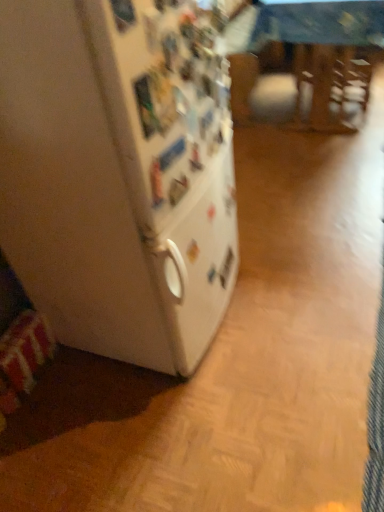
Find the location of `wooden table at center`. wooden table at center is located at coordinates (319, 23).

What do you see at coordinates (319, 23) in the screenshot?
I see `wooden table at center` at bounding box center [319, 23].

What is the approximate width of wooden table at center?

wooden table at center is 3.66 feet in width.

Describe the element at coordinates (119, 174) in the screenshot. I see `white matte refrigerator at left` at that location.

Where is `white matte refrigerator at left`? white matte refrigerator at left is located at coordinates (119, 174).

Identify the location of wooden table at center. Image resolution: width=384 pixels, height=512 pixels. (319, 23).

Does white matte refrigerator at left appear on the right side of wooden table at center?

No.

Which object is closer to the camera, white matte refrigerator at left or wooden table at center?

white matte refrigerator at left is in front.

Does point (215, 198) lie behind point (252, 49)?

That is False.

From the image's perspective, is white matte refrigerator at left located above or below wooden table at center?

Clearly, from the image's perspective, white matte refrigerator at left is below wooden table at center.

From a real-world perspective, is white matte refrigerator at left located beneath wooden table at center?

No, from a real-world perspective, white matte refrigerator at left is not beneath wooden table at center.

Does white matte refrigerator at left have a greater width compared to wooden table at center?

Incorrect, the width of white matte refrigerator at left does not surpass that of wooden table at center.

Considering the sizes of objects white matte refrigerator at left and wooden table at center in the image provided, who is shorter, white matte refrigerator at left or wooden table at center?

With less height is wooden table at center.

Is white matte refrigerator at left smaller than wooden table at center?

Yes.

Is wooden table at center inside white matte refrigerator at left?

No, wooden table at center is not a part of white matte refrigerator at left.

Consider the image. Is white matte refrigerator at left with wooden table at center?

They are not placed beside each other.

Could you tell me if white matte refrigerator at left is turned towards wooden table at center?

No, white matte refrigerator at left does not turn towards wooden table at center.

How different are the orientations of white matte refrigerator at left and wooden table at center in degrees?

There is a 2.61-degree angle between the facing directions of white matte refrigerator at left and wooden table at center.

Find the location of a particular element. The width and height of the screenshot is (384, 512). table located underneath the white matte refrigerator at left (from a real-world perspective) is located at coordinates [319, 23].

Considering the positions of objects wooden table at center and white matte refrigerator at left in the image provided, who is more to the right, wooden table at center or white matte refrigerator at left?

Positioned to the right is wooden table at center.

Considering their positions, is wooden table at center located in front of or behind white matte refrigerator at left?

wooden table at center is positioned farther from the viewer than white matte refrigerator at left.

Is point (370, 18) positioned after point (66, 213)?

That is True.

From the image's perspective, would you say wooden table at center is shown under white matte refrigerator at left?

Actually, wooden table at center appears above white matte refrigerator at left in the image.

From a real-world perspective, is wooden table at center on white matte refrigerator at left?

No, from a real-world perspective, wooden table at center is not above white matte refrigerator at left.

Between wooden table at center and white matte refrigerator at left, which one has larger width?

wooden table at center.

Is wooden table at center taller or shorter than white matte refrigerator at left?

wooden table at center is shorter than white matte refrigerator at left.

Considering the relative sizes of wooden table at center and white matte refrigerator at left in the image provided, is wooden table at center bigger than white matte refrigerator at left?

Yes.

From the picture: Does wooden table at center contain white matte refrigerator at left?

No, white matte refrigerator at left is located outside of wooden table at center.

Are wooden table at center and white matte refrigerator at left far apart?

That's right, there is a large distance between wooden table at center and white matte refrigerator at left.

Is wooden table at center oriented towards white matte refrigerator at left?

No, wooden table at center is not turned towards white matte refrigerator at left.

What's the angular difference between wooden table at center and white matte refrigerator at left's facing directions?

The facing directions of wooden table at center and white matte refrigerator at left are 2.61 degrees apart.

Measure the distance from wooden table at center to white matte refrigerator at left.

1.57 meters.

Where is `table located underneath the white matte refrigerator at left (from a real-world perspective)`? table located underneath the white matte refrigerator at left (from a real-world perspective) is located at coordinates tap(319, 23).

Image resolution: width=384 pixels, height=512 pixels. I want to click on table below the white matte refrigerator at left (from a real-world perspective), so click(319, 23).

What are the coordinates of `refrigerator lying below the wooden table at center (from the image's perspective)` in the screenshot? It's located at (119, 174).